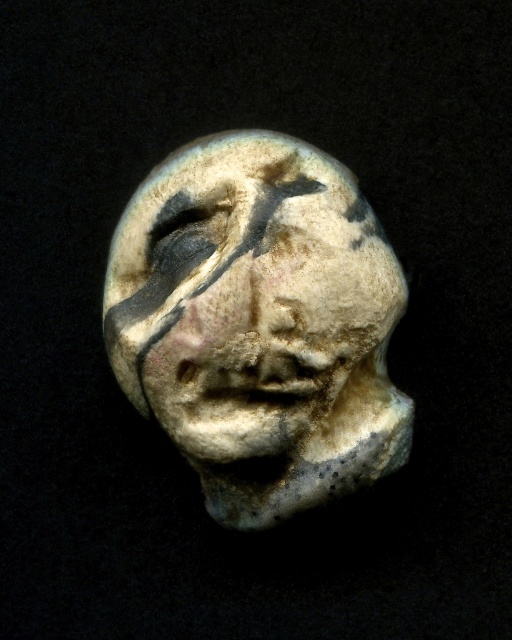
Question: Can you confirm if speckled clay face at center is positioned to the left of matte white skull at center?

Choices:
 (A) yes
 (B) no

Answer: (B)

Question: Which point is farther to the camera?

Choices:
 (A) (221, 435)
 (B) (259, 177)

Answer: (B)

Question: Can you confirm if speckled clay face at center is positioned to the right of matte white skull at center?

Choices:
 (A) no
 (B) yes

Answer: (B)

Question: Is speckled clay face at center smaller than matte white skull at center?

Choices:
 (A) no
 (B) yes

Answer: (A)

Question: Among these objects, which one is nearest to the camera?

Choices:
 (A) matte white skull at center
 (B) speckled clay face at center

Answer: (B)